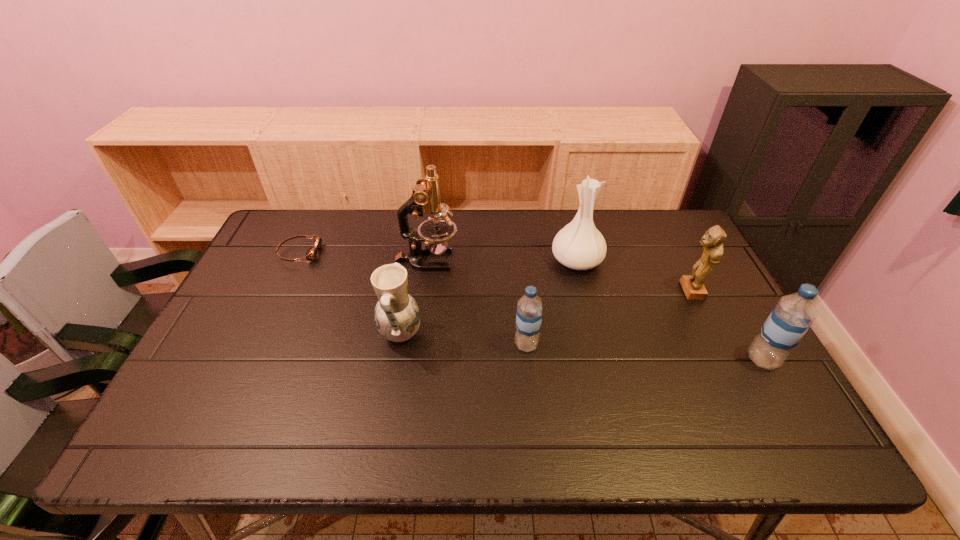
At what (x,y) coordinates should I click in order to perform the action: click on free space between the microscope and the shorter water bottle. Please return your answer as a coordinate pair (x, y). Looking at the image, I should click on (476, 302).

This screenshot has width=960, height=540. Identify the location of free space between the pottery and the sixth object from left to right. (545, 313).

Locate which object ranks fourth in proximity to the pottery. Please provide its 2D coordinates. Your answer should be formatted as a tuple, i.e. [(x, y)], where the tuple contains the x and y coordinates of a point satisfying the conditions above.

[(579, 245)]

Image resolution: width=960 pixels, height=540 pixels. In order to click on object that is the sixth closest to the third object from right to left in this screenshot , I will do `click(311, 254)`.

At what (x,y) coordinates should I click in order to perform the action: click on vacant space that satisfies the following two spatial constraints: 1. on the back side of the third object from right to left; 2. through the lenses of the shortest object. Please return your answer as a coordinate pair (x, y). The width and height of the screenshot is (960, 540). Looking at the image, I should click on (575, 253).